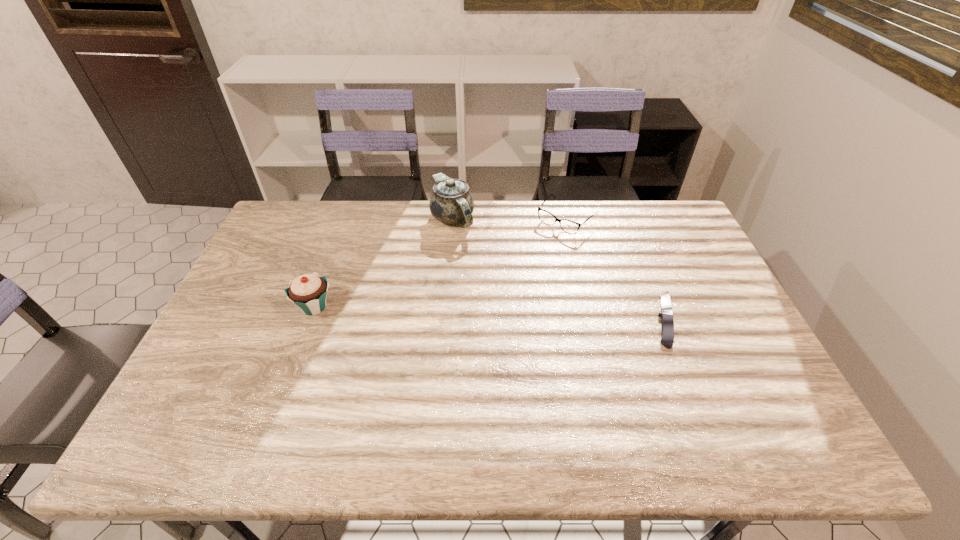
The image size is (960, 540). I want to click on vacant area between the shortest object and the second object from left to right, so click(x=559, y=269).

The width and height of the screenshot is (960, 540). Identify the location of free space between the third object from left to right and the shortest object. (615, 269).

In order to click on unoccupied area between the chinaware and the cupcake in this screenshot , I will do `click(383, 262)`.

The image size is (960, 540). Find the location of `vacant space in between the spectacles and the shortest object`. vacant space in between the spectacles and the shortest object is located at coordinates (615, 269).

The image size is (960, 540). I want to click on free spot between the leftmost object and the tallest object, so click(x=383, y=262).

Find the location of a particular element. This screenshot has width=960, height=540. unoccupied area between the spectacles and the cupcake is located at coordinates (441, 263).

At what (x,y) coordinates should I click in order to perform the action: click on object that is the third closest one to the second tallest object. Please return your answer as a coordinate pair (x, y). The height and width of the screenshot is (540, 960). Looking at the image, I should click on (667, 323).

Locate which object is the closest to the chinaware. Please provide its 2D coordinates. Your answer should be formatted as a tuple, i.e. [(x, y)], where the tuple contains the x and y coordinates of a point satisfying the conditions above.

[(568, 226)]

At what (x,y) coordinates should I click in order to perform the action: click on free location that satisfies the following two spatial constraints: 1. on the back side of the spectacles; 2. on the right side of the third shortest object. Please return your answer as a coordinate pair (x, y). Looking at the image, I should click on (347, 219).

The width and height of the screenshot is (960, 540). Identify the location of vacant space that satisfies the following two spatial constraints: 1. on the front side of the shortest object; 2. on the right side of the leftmost object. tap(310, 319).